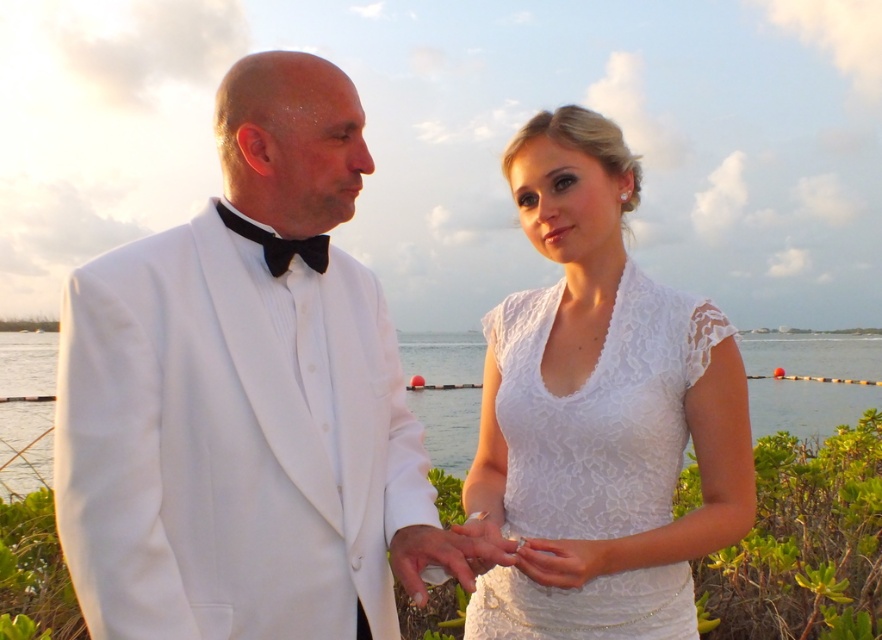
You are a photographer positioned behind the white satin tuxedo at left and the clear water at center. Which object is nearer to you as you prepare to take a photo?

The white satin tuxedo at left is closer to the photographer than the clear water at center, so it will appear nearer in the photo.

You are a photographer at a wedding reception. You need to capture a closeup shot of the lace fabric dress at center without the white satin tuxedo at left appearing in the background. The camera has a depth of field that can blur objects beyond 15 inches away. Can you achieve this?

The white satin tuxedo at left is 15.31 inches away from the lace fabric dress at center. Since the depth of field blurs objects beyond 15 inches, the tuxedo is just slightly out of range, so it will be blurred. Yes, you can capture the closeup.